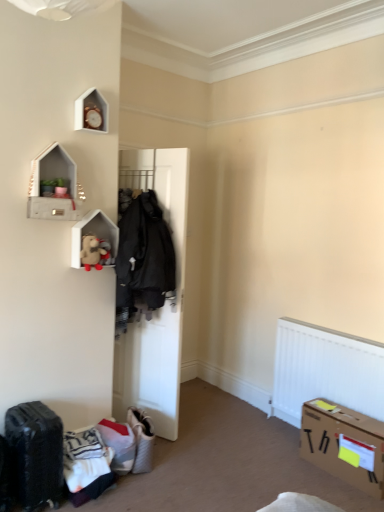
Question: Is white matte door at center not close to white textured fabric suitcase at lower center, which is the 1th luggage from right to left?

Choices:
 (A) yes
 (B) no

Answer: (B)

Question: From the image's perspective, is white matte door at center below white textured fabric suitcase at lower center, which is the 1th luggage from right to left?

Choices:
 (A) yes
 (B) no

Answer: (B)

Question: Can you confirm if white matte door at center is smaller than white textured fabric suitcase at lower center, which is the 1th luggage from right to left?

Choices:
 (A) yes
 (B) no

Answer: (B)

Question: From a real-world perspective, is white matte door at center located beneath white textured fabric suitcase at lower center, the 2th luggage from the front?

Choices:
 (A) yes
 (B) no

Answer: (B)

Question: Is white matte door at center to the left of white textured fabric suitcase at lower center, the 1th luggage positioned from the back, from the viewer's perspective?

Choices:
 (A) no
 (B) yes

Answer: (B)

Question: Is the surface of white matte door at center in direct contact with white textured fabric suitcase at lower center, which is the 1th luggage from right to left?

Choices:
 (A) yes
 (B) no

Answer: (B)

Question: From a real-world perspective, is white matte wooden shelf at upper left, arranged as the second shelf when viewed from the top, on top of white matte door at center?

Choices:
 (A) yes
 (B) no

Answer: (A)

Question: Is white matte wooden shelf at upper left, which ranks as the first shelf in back-to-front order, next to white matte door at center and touching it?

Choices:
 (A) no
 (B) yes

Answer: (A)

Question: Does white matte wooden shelf at upper left, arranged as the second shelf when viewed from the top, have a smaller size compared to white matte door at center?

Choices:
 (A) yes
 (B) no

Answer: (A)

Question: Is the position of white matte wooden shelf at upper left, which is the first shelf in bottom-to-top order, more distant than that of white matte door at center?

Choices:
 (A) no
 (B) yes

Answer: (A)

Question: Considering the relative sizes of white matte wooden shelf at upper left, arranged as the second shelf when viewed from the top, and white matte door at center in the image provided, is white matte wooden shelf at upper left, arranged as the second shelf when viewed from the top, thinner than white matte door at center?

Choices:
 (A) yes
 (B) no

Answer: (A)

Question: Is white matte wooden shelf at upper left, which ranks as the first shelf in back-to-front order, bigger than white matte door at center?

Choices:
 (A) yes
 (B) no

Answer: (B)

Question: From the image's perspective, is fuzzy beige teddy bear at upper left beneath white textured fabric suitcase at lower center, the 2th luggage from the front?

Choices:
 (A) no
 (B) yes

Answer: (A)